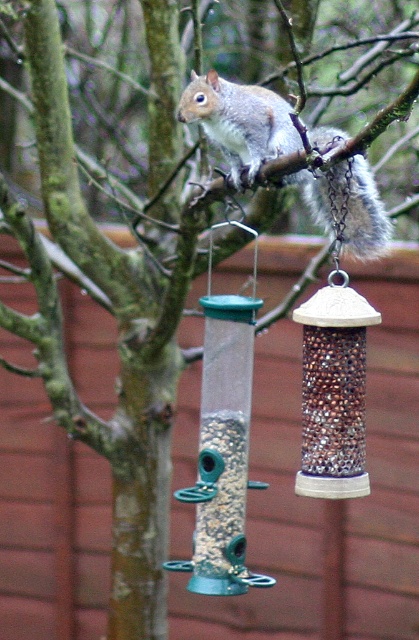
You are a bird trying to choose between the shiny metallic seed at center and the brown textured seed at lower center. Which seed is wider?

The brown textured seed at lower center is wider than the shiny metallic seed at center.

You are a photographer standing in front of a tree with a gray furry squirrel at upper center. You want to take a closeup photo of the squirrel. If your camera requires you to be at least 1.5 meters away to focus properly, will you need to move closer or farther away?

The distance between the gray furry squirrel at upper center and the camera is 1.76 meters. Since the minimum focusing distance is 1.5 meters, you do not need to move closer. You can take the photo from your current position.